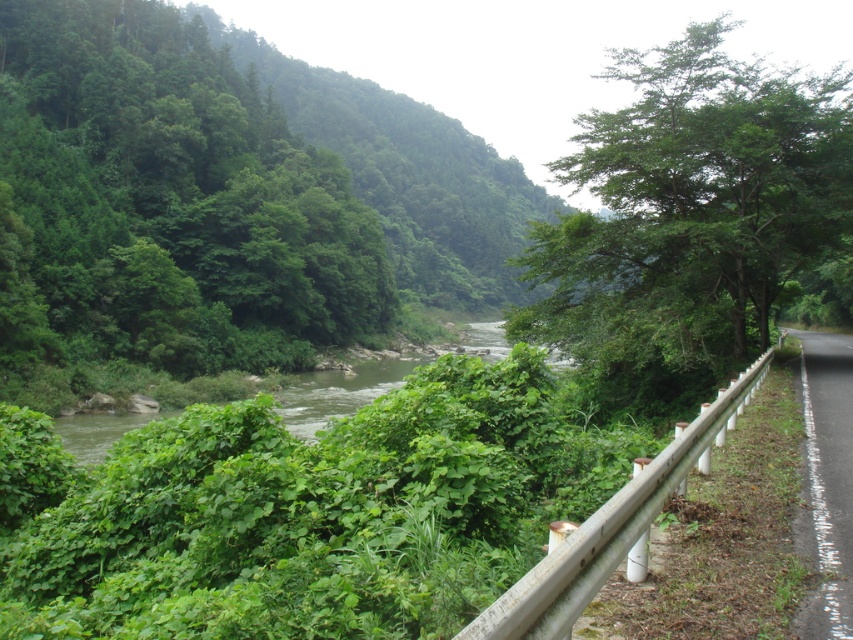
Can you confirm if green leafy tree at right is positioned above white asphalt road at right?

Yes.

Based on the photo, who is positioned more to the right, green leafy tree at right or white asphalt road at right?

Positioned to the right is green leafy tree at right.

Which is in front, point (706, 273) or point (813, 524)?

Point (813, 524)

You are a GUI agent. You are given a task and a screenshot of the screen. Output one action in this format:
    pyautogui.click(x=<x>, y=<y>)
    Task: Click on the green leafy tree at right
    The image size is (853, 640).
    Given the screenshot: What is the action you would take?
    pyautogui.click(x=689, y=216)

Does white asphalt road at right appear over green leafy river at center?

Yes, white asphalt road at right is above green leafy river at center.

What do you see at coordinates (827, 480) in the screenshot? I see `white asphalt road at right` at bounding box center [827, 480].

Where is `white asphalt road at right`? white asphalt road at right is located at coordinates (827, 480).

Between green leafy tree at left and green leafy river at center, which one appears on the right side from the viewer's perspective?

Positioned to the right is green leafy river at center.

Who is taller, green leafy tree at left or green leafy river at center?

green leafy tree at left is taller.

Which is in front, point (309, 250) or point (329, 417)?

Point (329, 417)

Where is `green leafy tree at left`? This screenshot has height=640, width=853. green leafy tree at left is located at coordinates (167, 202).